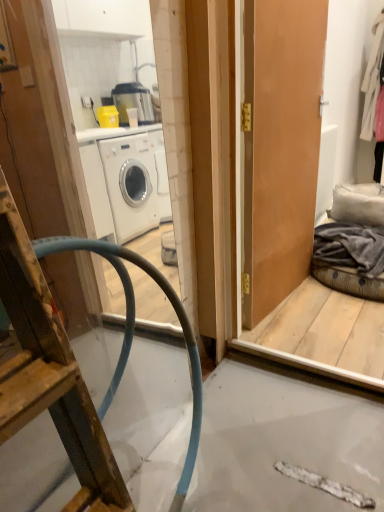
Question: In the image, is white wool coat at upper right, arranged as the 2th clothing when viewed from the front, on the left side or the right side of matte brown door at center?

Choices:
 (A) left
 (B) right

Answer: (B)

Question: Is white wool coat at upper right, the second clothing in the left-to-right sequence, in front of or behind matte brown door at center in the image?

Choices:
 (A) front
 (B) behind

Answer: (B)

Question: Estimate the real-world distances between objects in this image. Which object is closer to the blue rubber hose at left?

Choices:
 (A) white textured radiator at right
 (B) matte brown door at center
 (C) gray cotton blanket at right, which is counted as the second clothing, starting from the top
 (D) white wool coat at upper right, the 1th clothing from the back

Answer: (B)

Question: Estimate the real-world distances between objects in this image. Which object is farther from the white wool coat at upper right, the 1th clothing from the back?

Choices:
 (A) blue rubber hose at left
 (B) white textured radiator at right
 (C) gray cotton blanket at right, which is counted as the second clothing, starting from the top
 (D) matte brown door at center

Answer: (A)